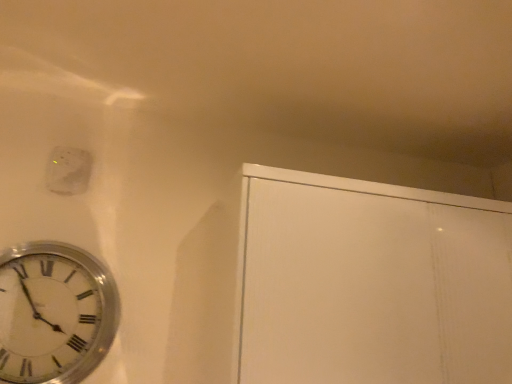
Question: Is white matte cabinet at upper right far away from silver metallic clock at lower left?

Choices:
 (A) yes
 (B) no

Answer: (B)

Question: Considering the relative sizes of white matte cabinet at upper right and silver metallic clock at lower left in the image provided, is white matte cabinet at upper right bigger than silver metallic clock at lower left?

Choices:
 (A) no
 (B) yes

Answer: (B)

Question: From the image's perspective, would you say white matte cabinet at upper right is positioned over silver metallic clock at lower left?

Choices:
 (A) no
 (B) yes

Answer: (B)

Question: From the image's perspective, is white matte cabinet at upper right beneath silver metallic clock at lower left?

Choices:
 (A) yes
 (B) no

Answer: (B)

Question: Is silver metallic clock at lower left a part of white matte cabinet at upper right?

Choices:
 (A) no
 (B) yes

Answer: (A)

Question: Is silver metallic clock at lower left situated inside white matte cabinet at upper right or outside?

Choices:
 (A) outside
 (B) inside

Answer: (A)

Question: Is silver metallic clock at lower left wider or thinner than white matte cabinet at upper right?

Choices:
 (A) thin
 (B) wide

Answer: (A)

Question: Considering the positions of silver metallic clock at lower left and white matte cabinet at upper right in the image, is silver metallic clock at lower left taller or shorter than white matte cabinet at upper right?

Choices:
 (A) short
 (B) tall

Answer: (A)

Question: Based on their positions, is silver metallic clock at lower left located to the left or right of white matte cabinet at upper right?

Choices:
 (A) left
 (B) right

Answer: (A)

Question: From the image's perspective, relative to white matte electric outlet at upper left, is white matte cabinet at upper right above or below?

Choices:
 (A) below
 (B) above

Answer: (A)

Question: Is white matte cabinet at upper right taller or shorter than white matte electric outlet at upper left?

Choices:
 (A) tall
 (B) short

Answer: (A)

Question: Considering the relative positions of white matte cabinet at upper right and white matte electric outlet at upper left in the image provided, is white matte cabinet at upper right to the left or to the right of white matte electric outlet at upper left?

Choices:
 (A) right
 (B) left

Answer: (A)

Question: From a real-world perspective, is white matte cabinet at upper right above or below white matte electric outlet at upper left?

Choices:
 (A) below
 (B) above

Answer: (A)

Question: In the image, is white matte electric outlet at upper left on the left side or the right side of silver metallic clock at lower left?

Choices:
 (A) left
 (B) right

Answer: (A)

Question: From the image's perspective, relative to silver metallic clock at lower left, is white matte electric outlet at upper left above or below?

Choices:
 (A) below
 (B) above

Answer: (B)